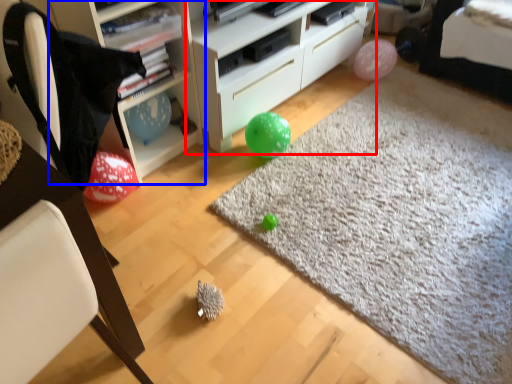
Question: Which object appears closest to the camera in this image, cabinetry (highlighted by a red box) or shelf (highlighted by a blue box)?

Choices:
 (A) cabinetry
 (B) shelf

Answer: (B)